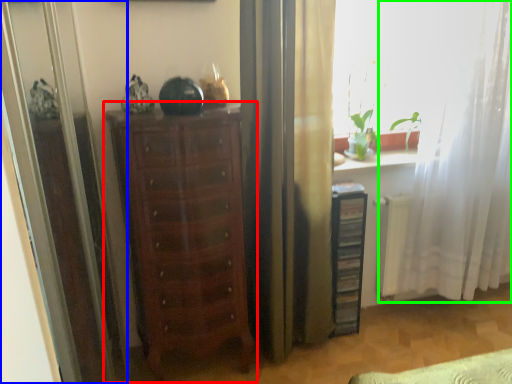
Question: Which is farther away from chest of drawers (highlighted by a red box)? screen door (highlighted by a blue box) or curtain (highlighted by a green box)?

Choices:
 (A) screen door
 (B) curtain

Answer: (B)